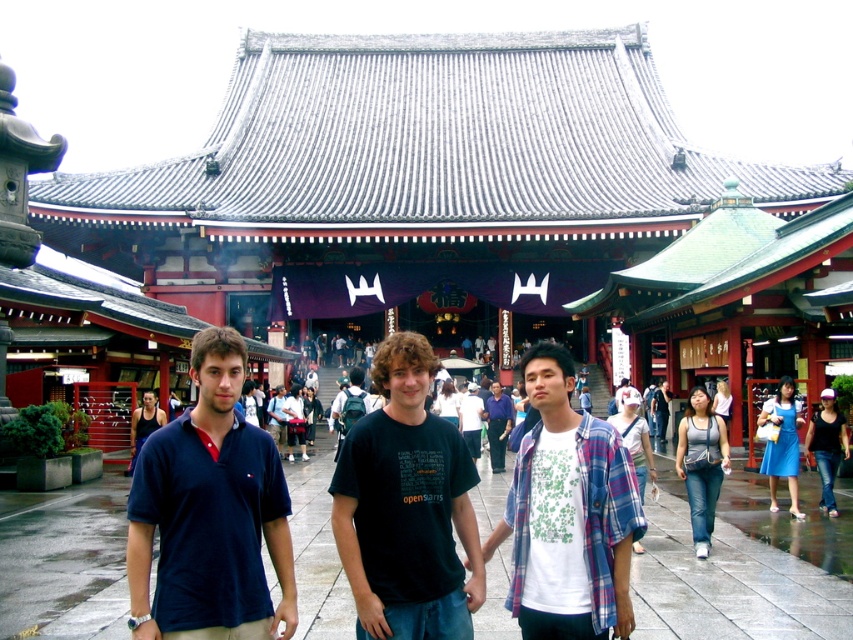
You are standing at the entrance of the temple and see the gray concrete pavement at center and the dark blue shirt at center. Which object is positioned to the left of the other?

The gray concrete pavement at center is to the left of dark blue shirt at center.